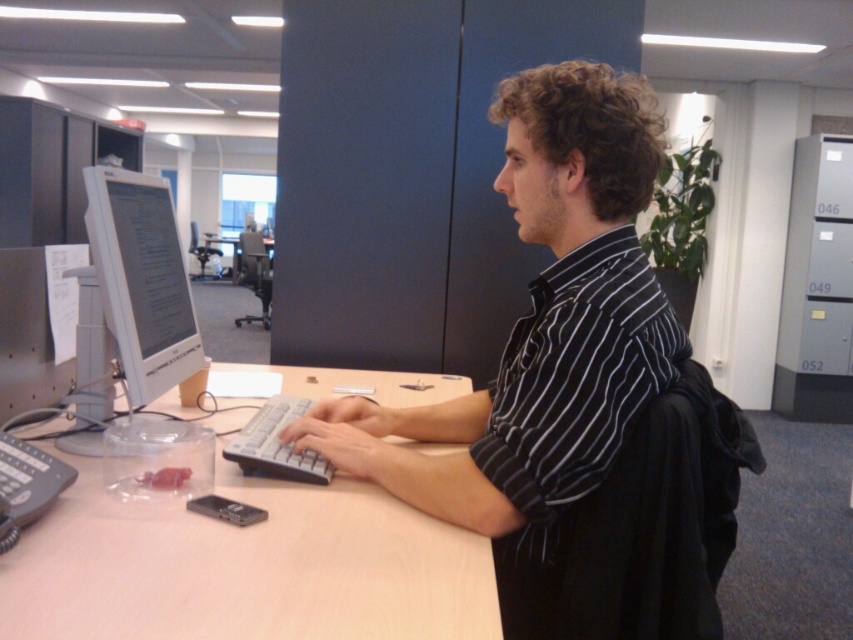
Question: Where is white plastic keyboard at center located in relation to wooden desk at center in the image?

Choices:
 (A) right
 (B) left

Answer: (A)

Question: Does light brown wood computer desk at center have a smaller size compared to wooden desk at center?

Choices:
 (A) yes
 (B) no

Answer: (A)

Question: Is white plastic monitor at left bigger than wooden desk at center?

Choices:
 (A) no
 (B) yes

Answer: (A)

Question: Which object appears closest to the camera in this image?

Choices:
 (A) light brown wood computer desk at center
 (B) wooden desk at center
 (C) black striped shirt at center

Answer: (A)

Question: Estimate the real-world distances between objects in this image. Which object is closer to the black striped shirt at center?

Choices:
 (A) wooden desk at center
 (B) white plastic monitor at left
 (C) white plastic keyboard at center
 (D) light brown wood computer desk at center

Answer: (C)

Question: Which object is farther from the camera taking this photo?

Choices:
 (A) white plastic monitor at left
 (B) light brown wood computer desk at center

Answer: (A)